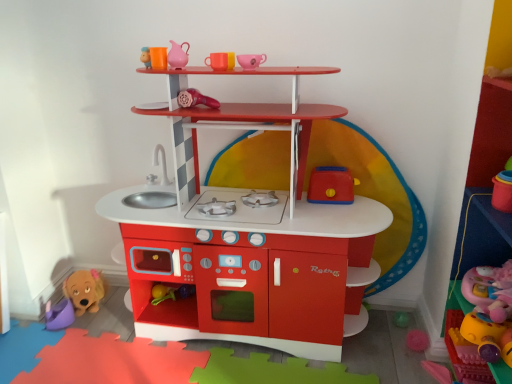
Question: From a real-world perspective, is matte plastic play kitchen at center, the fifth toy when ordered from left to right, physically located above or below matte ceramic cup at upper center, marked as the fifth toy in a right-to-left arrangement?

Choices:
 (A) above
 (B) below

Answer: (B)

Question: Looking at the image, does matte plastic play kitchen at center, the 4th toy positioned from the right, seem bigger or smaller compared to matte ceramic cup at upper center, marked as the fifth toy in a right-to-left arrangement?

Choices:
 (A) big
 (B) small

Answer: (A)

Question: Estimate the real-world distances between objects in this image. Which object is farther from the matte plastic play kitchen at center, the fifth toy when ordered from left to right?

Choices:
 (A) matte ceramic cup at upper center, which is counted as the fourth toy, starting from the left
 (B) matte pink pitcher at upper center, the 2th toy viewed from the left
 (C) rubberized plastic microphone at center, arranged as the 6th toy when viewed from the right
 (D) soft pink plush at lower right, positioned as the first toy in right-to-left order
 (E) purple plastic bucket at lower left, the 1th toy when ordered from left to right

Answer: (E)

Question: Estimate the real-world distances between objects in this image. Which object is farther from the rubberized plastic microphone at center, which ranks as the 3th toy in left-to-right order?

Choices:
 (A) purple plastic bucket at lower left, acting as the 8th toy starting from the right
 (B) matte ceramic cup at upper center, which is counted as the fourth toy, starting from the left
 (C) matte plastic play kitchen at center, the 4th toy positioned from the right
 (D) rubberized plastic toaster at center-right, placed as the 7th toy when sorted from left to right
 (E) pink matte cup at upper center, the third toy from the right

Answer: (A)